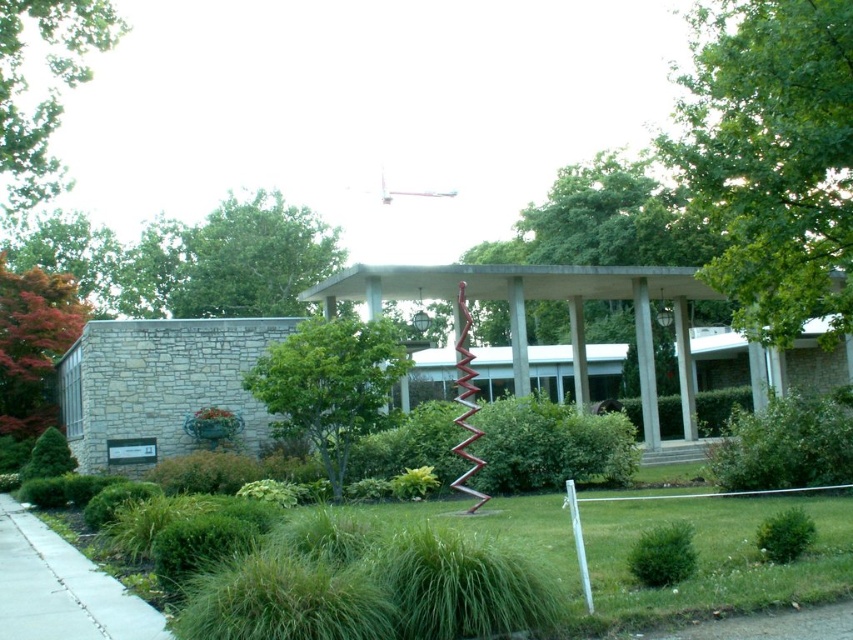
Question: Does green leafy tree at upper right come in front of reddish-brown bark tree at left?

Choices:
 (A) yes
 (B) no

Answer: (A)

Question: Which of these objects is positioned closest to the green leafy tree at upper right?

Choices:
 (A) green leafy tree at upper center
 (B) gray concrete sidewalk at lower left

Answer: (B)

Question: Which of the following is the closest to the observer?

Choices:
 (A) green leafy tree at upper right
 (B) green leafy tree at center
 (C) green leafy tree at upper center

Answer: (A)

Question: Does green leafy tree at upper right appear on the right side of green leafy tree at center?

Choices:
 (A) yes
 (B) no

Answer: (A)

Question: Does green leafy tree at center appear on the right side of green leafy tree at upper left?

Choices:
 (A) yes
 (B) no

Answer: (A)

Question: Which object is farther from the camera taking this photo?

Choices:
 (A) green leafy tree at center
 (B) gray concrete sidewalk at lower left
 (C) green leafy tree at upper center

Answer: (C)